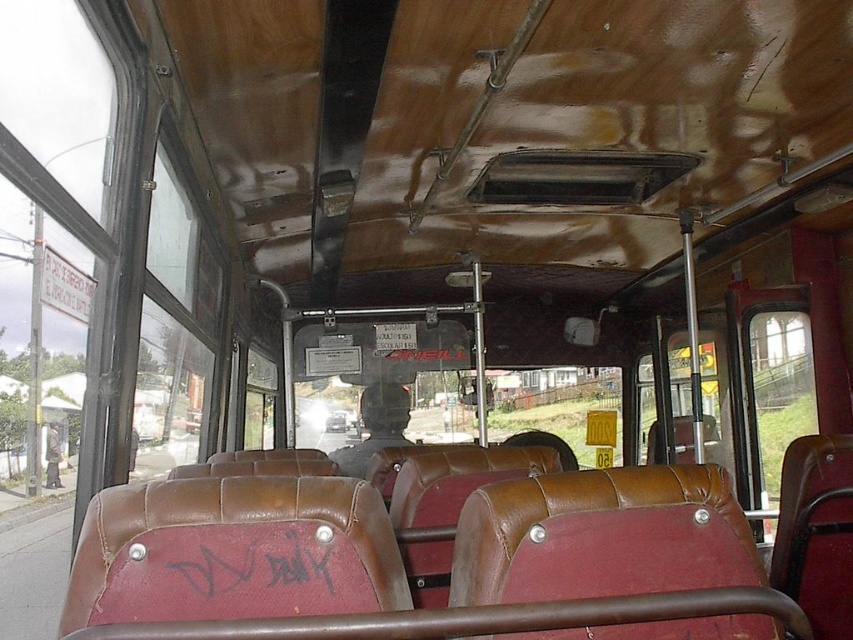
You are a passenger on the bus and want to look outside through the transparent glass window at left. However, there is black graffiti at center in your way. Can you still see the outside clearly?

The black graffiti at center is behind the transparent glass window at left, so it is on the same side as the window. This means the graffiti is not blocking your view and you can still see outside clearly through the transparent glass window at left.

You are a passenger on the bus and want to look outside. Which object, the transparent glass window at left or the black graffiti at center, would allow you to see the outside better?

The transparent glass window at left is taller than the black graffiti at center, so it would allow you to see the outside better.

You are a passenger on a bus and need to look outside. You see a transparent glass window at left and a matte black helmet at center. Which object allows you to see outside the bus?

The transparent glass window at left allows you to see outside the bus because it is positioned in front of the matte black helmet at center, making it the visible option for viewing the outside environment.